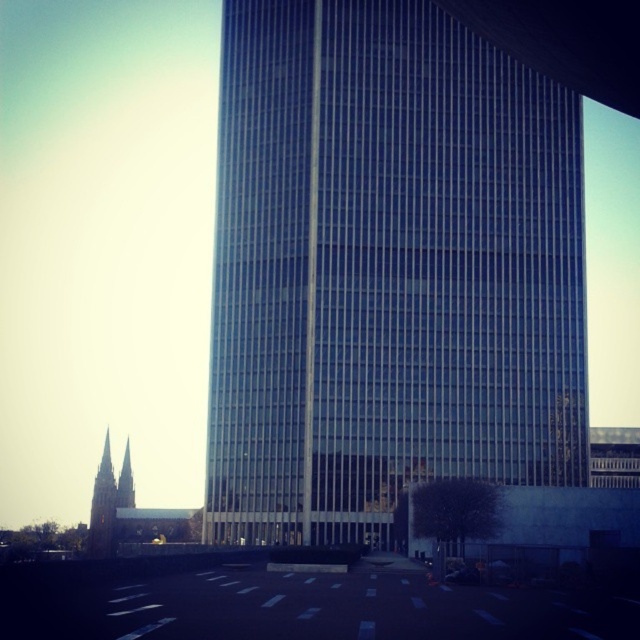
Is point (236, 413) farther from viewer compared to point (124, 493)?

No, (236, 413) is in front of (124, 493).

Does transparent glass tower at center appear on the right side of golden stone spire at left?

Correct, you'll find transparent glass tower at center to the right of golden stone spire at left.

Identify the location of transparent glass tower at center. (387, 269).